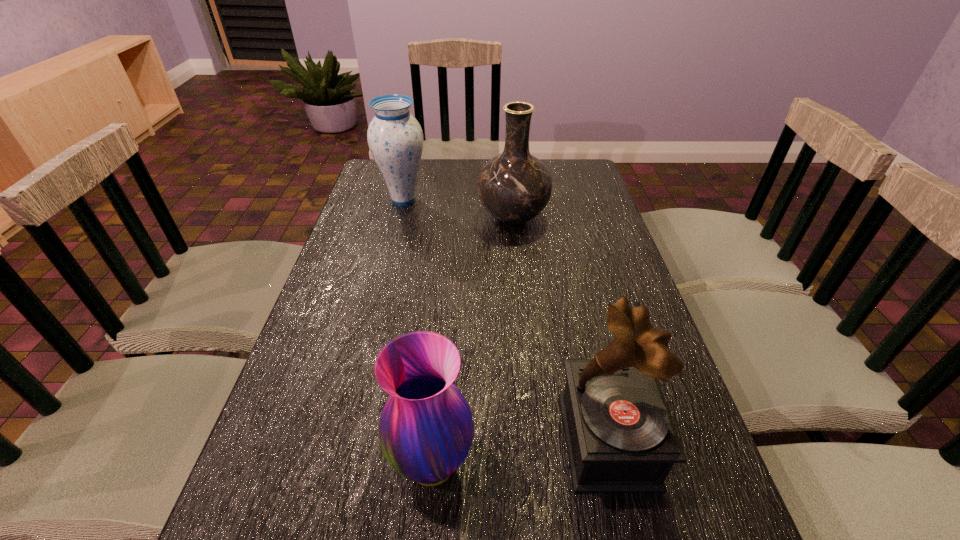
This screenshot has width=960, height=540. What are the coordinates of `vacant region located on the back of the nearest vase` in the screenshot? It's located at (444, 330).

This screenshot has height=540, width=960. Identify the location of object that is at the far edge. (395, 138).

Identify the location of object located in the left edge section of the desktop. [395, 138].

Identify the location of object located in the right edge section of the desktop. (620, 436).

Where is `object situated at the far left corner`? Image resolution: width=960 pixels, height=540 pixels. object situated at the far left corner is located at coordinates (395, 138).

What are the coordinates of `blank space at the far edge` in the screenshot? It's located at (449, 172).

The height and width of the screenshot is (540, 960). In order to click on vacant area at the left edge in this screenshot , I will do `click(351, 234)`.

Find the location of `vacant space at the right edge`. vacant space at the right edge is located at coordinates (682, 478).

Find the location of a particular element. Image resolution: width=960 pixels, height=540 pixels. free location at the far right corner of the desktop is located at coordinates (564, 191).

The height and width of the screenshot is (540, 960). I want to click on free area in between the leftmost object and the rightmost vase, so click(x=458, y=208).